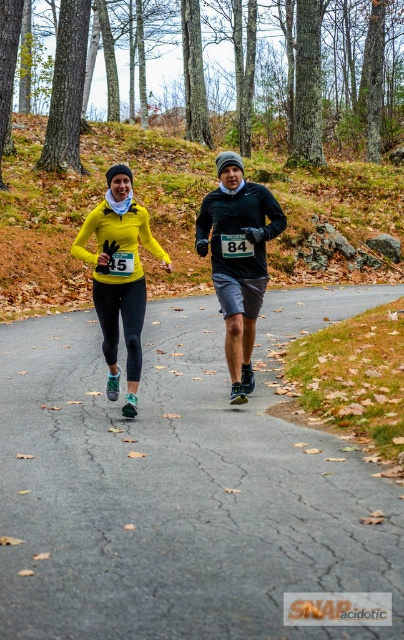
You are a photographer positioned at the starting line of a race. You need to capture a photo that includes both the matte black jacket at center and the matte yellow jacket at center. Which jacket should you adjust your focus to first to ensure both are in frame?

The matte black jacket at center is further to the viewer than the matte yellow jacket at center, so you should focus on the matte black jacket at center first to ensure both are in frame.

You are a runner in a race and need to cross the matte asphalt road at center while avoiding the matte black jacket at center. Can you safely pass through the road without stepping on the jacket?

The matte asphalt road at center is wider than the matte black jacket at center, so yes, you can safely pass through the road without stepping on the jacket.